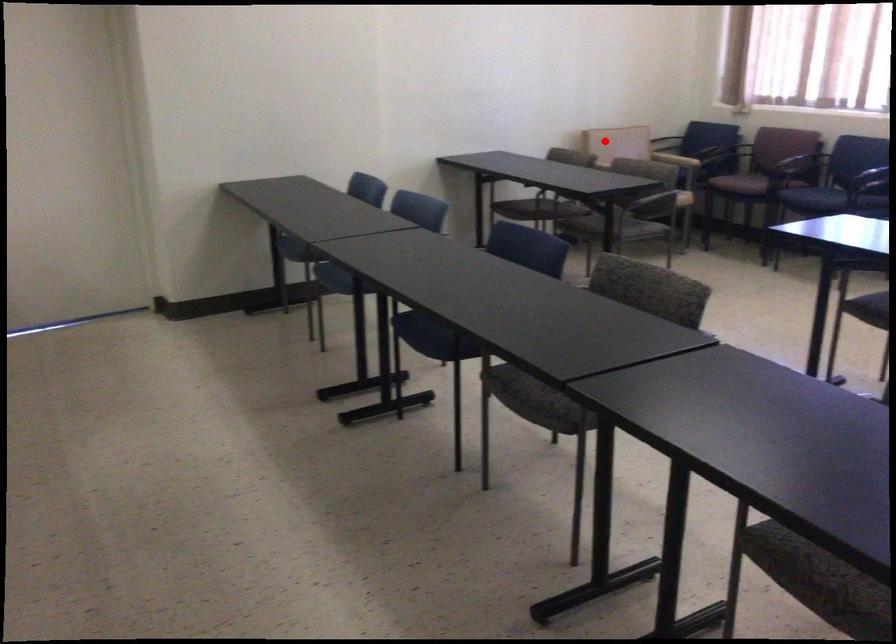
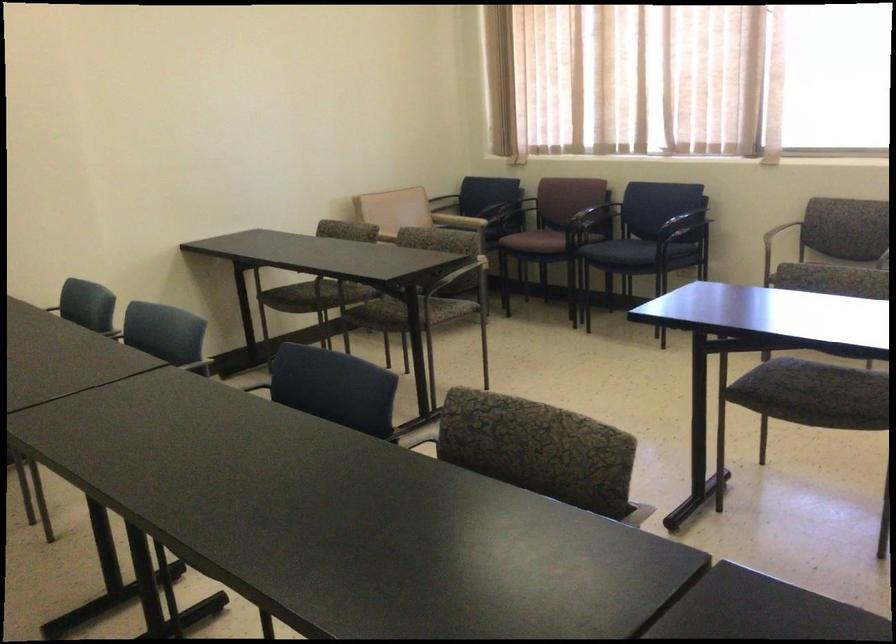
The point at the highlighted location is marked in the first image. Where is the corresponding point in the second image?

(381, 205)